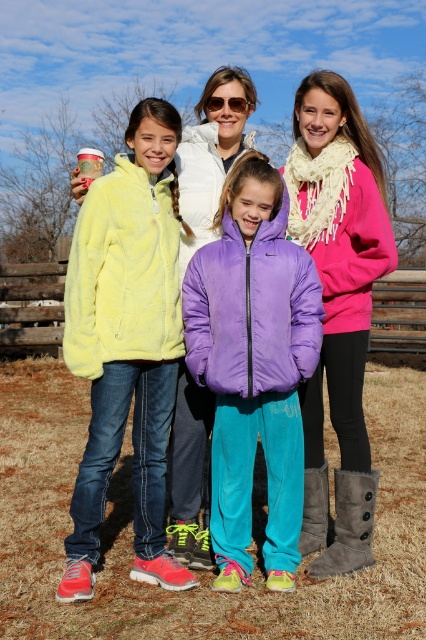
In the scene shown: Is fluffy yellow jacket at left smaller than gray suede boot at lower right?

Incorrect, fluffy yellow jacket at left is not smaller in size than gray suede boot at lower right.

Which of these two, fluffy yellow jacket at left or gray suede boot at lower right, stands shorter?

gray suede boot at lower right

Locate an element on the screen. This screenshot has height=640, width=426. fluffy yellow jacket at left is located at coordinates (126, 342).

Does brown suede boot at lower center have a larger size compared to gray suede boot at lower right?

Yes.

Is brown suede boot at lower center wider than gray suede boot at lower right?

Yes, brown suede boot at lower center is wider than gray suede boot at lower right.

Between point (327, 564) and point (316, 528), which one is positioned in front?

Positioned in front is point (327, 564).

You are a GUI agent. You are given a task and a screenshot of the screen. Output one action in this format:
    pyautogui.click(x=<x>, y=<y>)
    Task: Click on the brown suede boot at lower center
    The width and height of the screenshot is (426, 640).
    Given the screenshot: What is the action you would take?
    pyautogui.click(x=350, y=525)

Who is positioned more to the right, matte yellow jacket at left or pink fleece jacket at center?

Positioned to the right is pink fleece jacket at center.

Can you confirm if matte yellow jacket at left is smaller than pink fleece jacket at center?

No.

Where is `matte yellow jacket at left`? matte yellow jacket at left is located at coordinates (337, 252).

The width and height of the screenshot is (426, 640). In order to click on matte yellow jacket at left in this screenshot , I will do `click(337, 252)`.